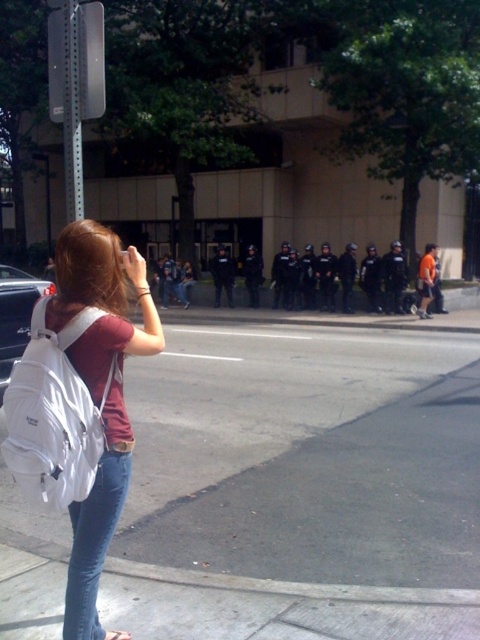
You are a photographer trying to capture a clear shot of the police officers in the background. You notice the metallic pole at upper left and the jeans at lower left might block your view. Which object is wider and could potentially block more of the scene?

The metallic pole at upper left might be wider than jeans at lower left, so it could block more of the scene.

You are a photographer trying to capture the best shot of the scene. You have two points marked on your viewfinder at coordinates point (66, 193) and point (75, 564). Which point is closer to your camera lens?

Point (66, 193) is further to the camera than point (75, 564), so the point closer to the camera lens is point (75, 564).